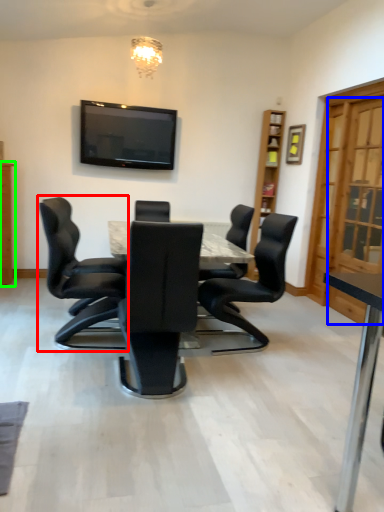
Question: Considering the real-world distances, which object is farthest from chair (highlighted by a red box)? glass door (highlighted by a blue box) or cabinetry (highlighted by a green box)?

Choices:
 (A) glass door
 (B) cabinetry

Answer: (A)